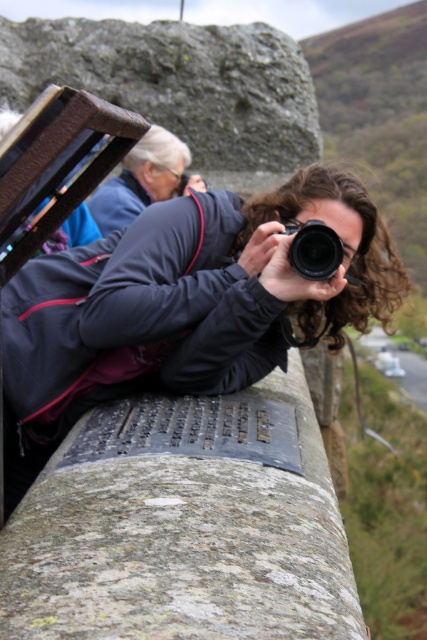
Can you confirm if matte black jacket at center is shorter than matte blue jacket at upper left?

Incorrect, matte black jacket at center's height does not fall short of matte blue jacket at upper left's.

Who is shorter, matte black jacket at center or matte blue jacket at upper left?

matte blue jacket at upper left is shorter.

Image resolution: width=427 pixels, height=640 pixels. I want to click on matte black jacket at center, so click(181, 307).

Measure the distance between point (125, 204) and camera.

8.63 meters

Between matte blue jacket at upper left and black plastic camera at center, which one is positioned lower?

black plastic camera at center

What do you see at coordinates (140, 179) in the screenshot? The image size is (427, 640). I see `matte blue jacket at upper left` at bounding box center [140, 179].

Locate an element on the screen. matte blue jacket at upper left is located at coordinates (140, 179).

Which is more to the right, matte black jacket at center or black plastic camera at center?

Positioned to the right is black plastic camera at center.

Between point (61, 374) and point (307, 225), which one is positioned behind?

The point (61, 374) is more distant.

Is point (359, 252) positioned in front of point (336, 236)?

No, it is behind (336, 236).

Identify the location of matte black jacket at center. Image resolution: width=427 pixels, height=640 pixels. click(181, 307).